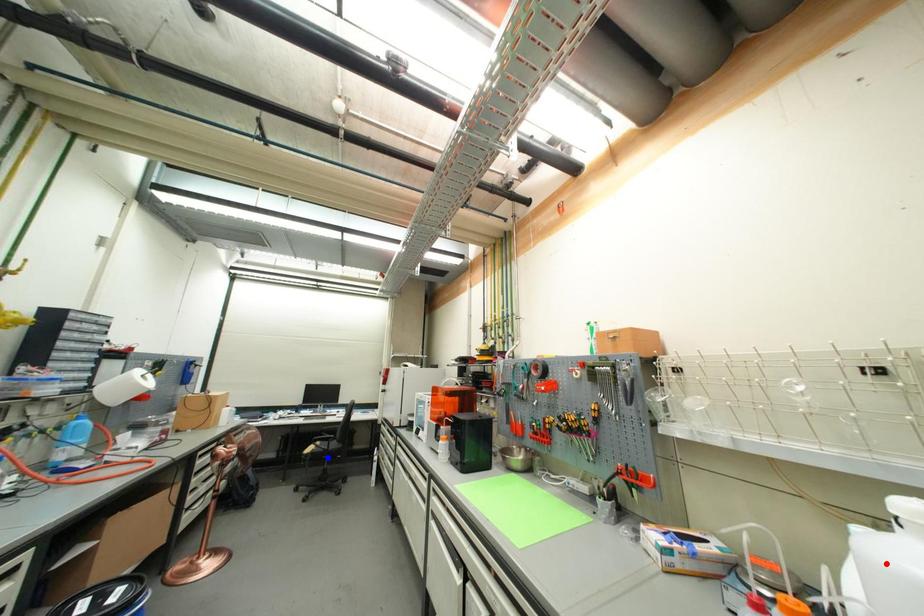
Question: In the image, two points are highlighted. Which point is nearer to the camera? Reply with the corresponding letter.

Choices:
 (A) blue point
 (B) red point

Answer: (B)